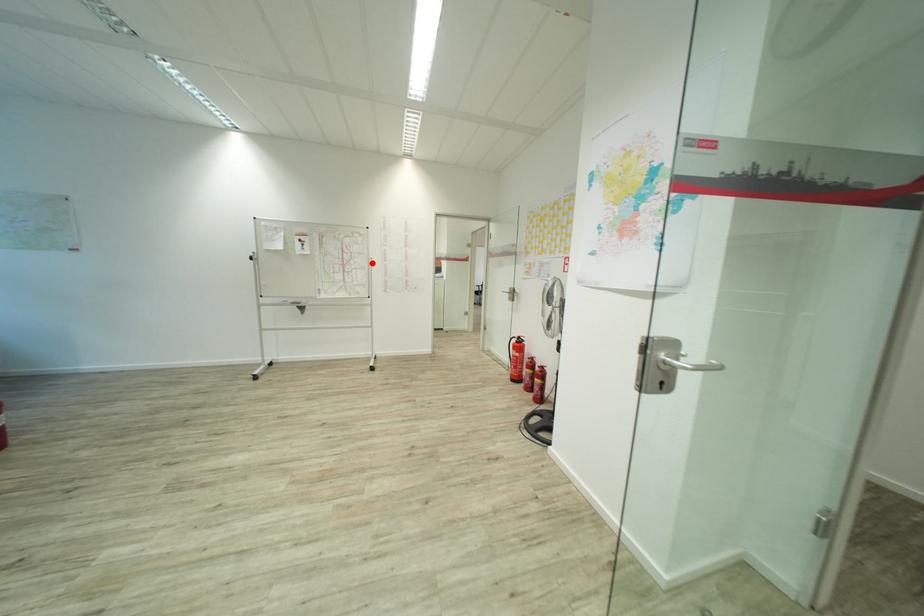
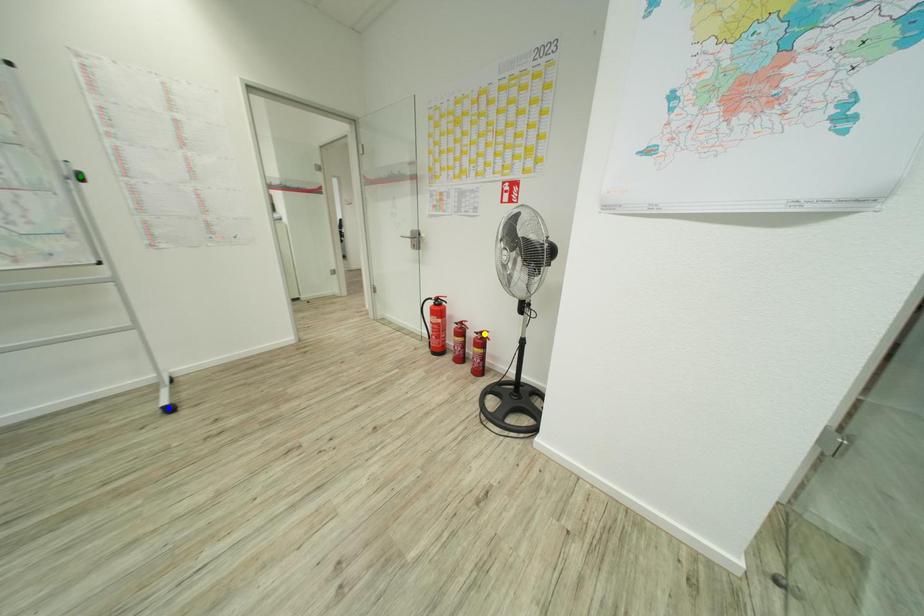
Question: I am providing you with two images of the same scene from different viewpoints. A red point is marked on the first image. You are given multiple points on the second image. Which spot in image 2 lines up with the point in image 1?

Choices:
 (A) green point
 (B) yellow point
 (C) blue point

Answer: (A)